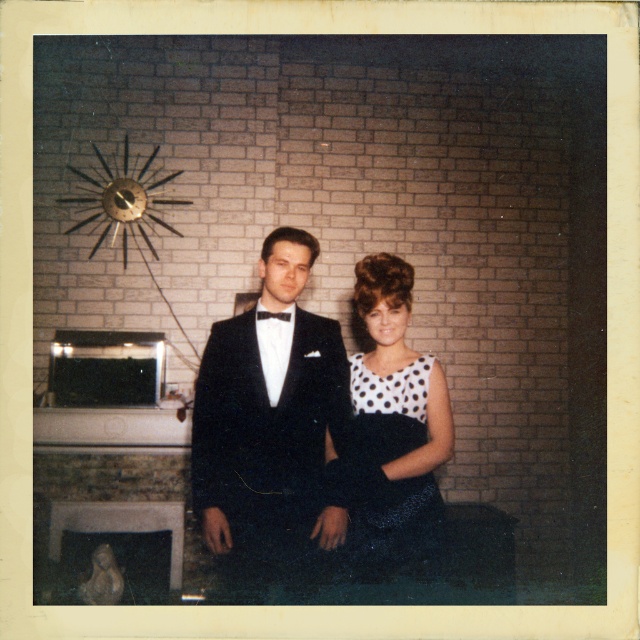
You are standing at the camera position and want to take a photo of the scene. If you move forward by 2 feet, how far will you be from the point at coordinates point (x=328, y=496)?

The point at coordinates point (x=328, y=496) is 7.97 feet away from the camera. If you move forward by 2 feet, you will be 5.97 feet away from the point at coordinates point (x=328, y=496).

You are a photographer adjusting the focus on your camera. You want to ensure both the black satin tuxedo at center and the white dotted dress at center are in focus. Which object should you focus on first to achieve this?

You should focus on the black satin tuxedo at center first because it is closer to the viewer than the white dotted dress at center, so adjusting focus starting from the closer object ensures both are in focus.

You are standing at the point marked as point (234, 532) in the image. The photographer wants to take a group photo of everyone in the scene. Can you walk towards the photographer to ensure you are in the frame?

Since the point marked as point (234, 532) and the viewer are 8.25 feet apart, you can walk towards the photographer to ensure you are in the frame.